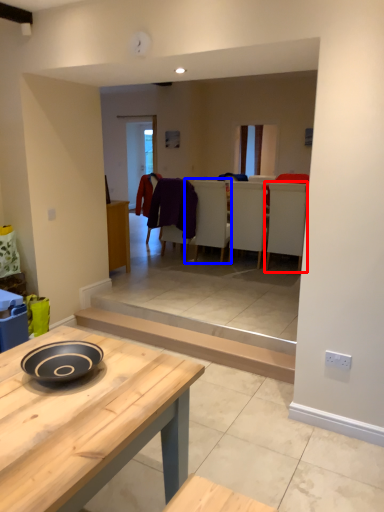
Question: Which object appears closest to the camera in this image, armchair (highlighted by a red box) or armchair (highlighted by a blue box)?

Choices:
 (A) armchair
 (B) armchair

Answer: (A)